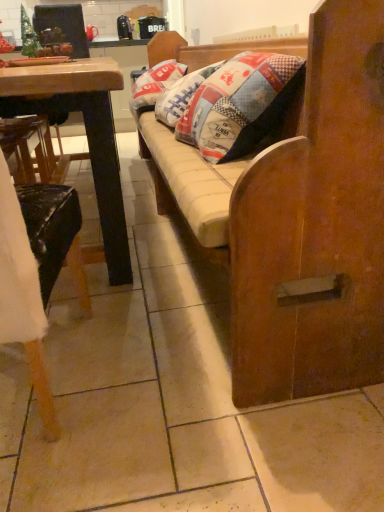
This screenshot has height=512, width=384. Find the location of `wooden chair at left`. wooden chair at left is located at coordinates (23, 298).

This screenshot has height=512, width=384. Identify the location of green matte christmas tree at upper left. (28, 35).

Measure the distance between wooden desk at left and camera.

32.13 inches.

Identify the location of wooden desk at left. This screenshot has width=384, height=512. (86, 133).

Identify the location of wooden studio couch at center. (299, 220).

Can you confirm if green matte christmas tree at upper left is shorter than patchwork fabric pillow at center?

Correct, green matte christmas tree at upper left is not as tall as patchwork fabric pillow at center.

In terms of width, does green matte christmas tree at upper left look wider or thinner when compared to patchwork fabric pillow at center?

green matte christmas tree at upper left is thinner than patchwork fabric pillow at center.

Is green matte christmas tree at upper left not within patchwork fabric pillow at center?

Yes, green matte christmas tree at upper left is not within patchwork fabric pillow at center.

Could you tell me if green matte christmas tree at upper left is turned towards patchwork fabric pillow at center?

No.

From the image's perspective, which is above, wooden chair at left or patchwork fabric pillow at center?

patchwork fabric pillow at center, from the image's perspective.

From a real-world perspective, relative to patchwork fabric pillow at center, is wooden chair at left vertically above or below?

wooden chair at left is below patchwork fabric pillow at center.

Image resolution: width=384 pixels, height=512 pixels. Identify the location of chair to the left of patchwork fabric pillow at center. (23, 298).

Is patchwork fabric pillow at center situated inside wooden desk at left or outside?

patchwork fabric pillow at center exists outside the volume of wooden desk at left.

Is patchwork fabric pillow at center thinner than wooden desk at left?

Correct, the width of patchwork fabric pillow at center is less than that of wooden desk at left.

Considering the sizes of objects patchwork fabric pillow at center and wooden desk at left in the image provided, who is shorter, patchwork fabric pillow at center or wooden desk at left?

With less height is patchwork fabric pillow at center.

Is patchwork fabric pillow at center aimed at wooden desk at left?

Yes.

Does green matte christmas tree at upper left have a lesser height compared to wooden chair at left?

Yes.

Is green matte christmas tree at upper left aimed at wooden chair at left?

No, green matte christmas tree at upper left is not turned towards wooden chair at left.

From a real-world perspective, is green matte christmas tree at upper left positioned above or below wooden chair at left?

green matte christmas tree at upper left is situated higher than wooden chair at left in the real world.

Is the surface of green matte christmas tree at upper left in direct contact with wooden chair at left?

No, green matte christmas tree at upper left is not with wooden chair at left.

Is wooden studio couch at center to the right of wooden chair at left from the viewer's perspective?

Correct, you'll find wooden studio couch at center to the right of wooden chair at left.

Considering the relative sizes of wooden studio couch at center and wooden chair at left in the image provided, is wooden studio couch at center bigger than wooden chair at left?

Yes, wooden studio couch at center is bigger than wooden chair at left.

What are the coordinates of `studio couch located above the wooden chair at left (from the image's perspective)` in the screenshot? It's located at (299, 220).

From the image's perspective, is wooden desk at left on green matte christmas tree at upper left?

No, from the image's perspective, wooden desk at left is not over green matte christmas tree at upper left.

Considering the sizes of objects wooden desk at left and green matte christmas tree at upper left in the image provided, who is taller, wooden desk at left or green matte christmas tree at upper left?

Standing taller between the two is wooden desk at left.

Is wooden desk at left wider than green matte christmas tree at upper left?

Yes.

Who is more distant, wooden desk at left or green matte christmas tree at upper left?

Positioned behind is green matte christmas tree at upper left.

Is wooden studio couch at center smaller than wooden desk at left?

Indeed, wooden studio couch at center has a smaller size compared to wooden desk at left.

Is point (353, 349) in front of point (20, 70)?

No, (353, 349) is further to viewer.

In terms of height, does wooden studio couch at center look taller or shorter compared to wooden desk at left?

Considering their sizes, wooden studio couch at center has more height than wooden desk at left.

At what (x,y) coordinates should I click in order to perform the action: click on desk that appears behind the wooden studio couch at center. Please return your answer as a coordinate pair (x, y). The width and height of the screenshot is (384, 512). Looking at the image, I should click on (86, 133).

In the image, there is a green matte christmas tree at upper left. Where is `pillow below it (from a real-world perspective)`? The image size is (384, 512). pillow below it (from a real-world perspective) is located at coordinates (155, 84).

I want to click on chair lying in front of the patchwork fabric pillow at center, so click(x=23, y=298).

Based on their spatial positions, is wooden studio couch at center or wooden desk at left further from wooden chair at left?

wooden studio couch at center is further to wooden chair at left.

Based on the photo, looking at the image, which one is located closer to patchwork fabric pillow at center, green matte christmas tree at upper left or wooden chair at left?

green matte christmas tree at upper left is positioned closer to the anchor patchwork fabric pillow at center.

Estimate the real-world distances between objects in this image. Which object is further from green matte christmas tree at upper left, wooden desk at left or patchwork fabric pillow at center?

wooden desk at left is positioned further to the anchor green matte christmas tree at upper left.

From the image, which object appears to be nearer to wooden desk at left, patchwork fabric pillow at center or wooden chair at left?

wooden chair at left.

Which object lies further to the anchor point wooden studio couch at center, patchwork fabric pillow at center or wooden desk at left?

Based on the image, patchwork fabric pillow at center appears to be further to wooden studio couch at center.

Based on their spatial positions, is wooden desk at left or green matte christmas tree at upper left closer to wooden chair at left?

The object closer to wooden chair at left is wooden desk at left.

Considering their positions, is patchwork fabric pillow at center positioned further to wooden desk at left than green matte christmas tree at upper left?

Among the two, green matte christmas tree at upper left is located further to wooden desk at left.

Based on their spatial positions, is wooden studio couch at center or patchwork fabric pillow at center closer to green matte christmas tree at upper left?

The object closer to green matte christmas tree at upper left is patchwork fabric pillow at center.

In order to click on desk between wooden studio couch at center and patchwork fabric pillow at center from front to back in this screenshot , I will do `click(86, 133)`.

Find the location of a particular element. desk located between wooden studio couch at center and green matte christmas tree at upper left in the depth direction is located at coordinates (86, 133).

Identify the location of christmas tree between wooden studio couch at center and patchwork fabric pillow at center in the front-back direction. This screenshot has width=384, height=512. (28, 35).

Locate an element on the screen. The image size is (384, 512). desk positioned between wooden chair at left and patchwork fabric pillow at center from near to far is located at coordinates (86, 133).